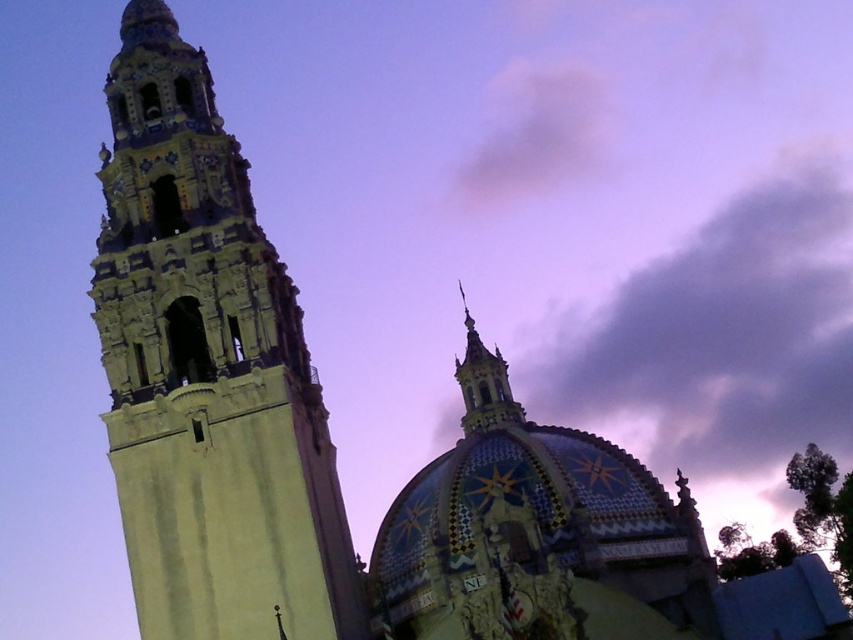
Which is more to the left, light beige stone tower at left or gray fluffy cloud at upper center?

From the viewer's perspective, light beige stone tower at left appears more on the left side.

Measure the distance between light beige stone tower at left and gray fluffy cloud at upper center.

They are 52.47 meters apart.

Is point (178, 268) in front of point (503, 92)?

That is True.

Locate an element on the screen. light beige stone tower at left is located at coordinates (207, 371).